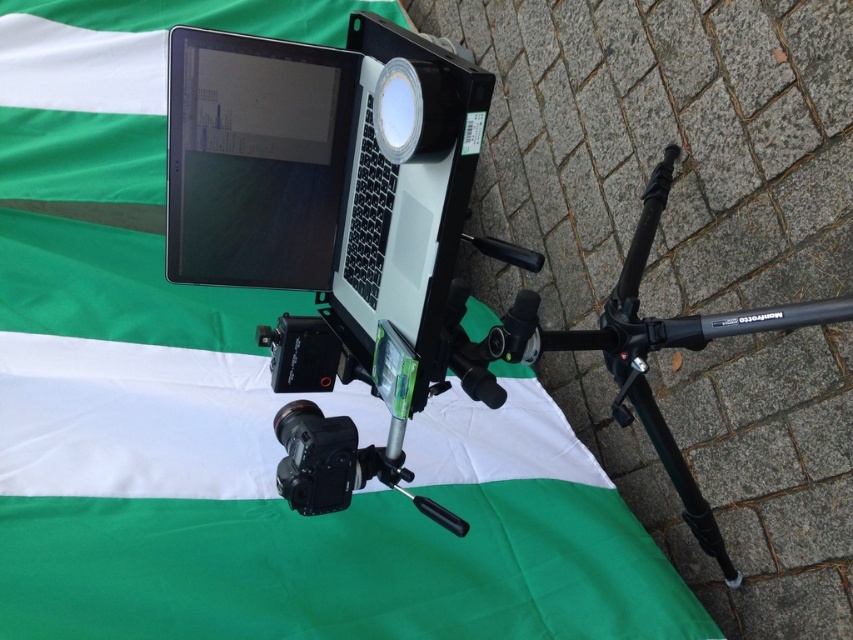
You are setting up equipment for a video call. You have a matte black laptop at upper center and a black matte tripod at center. Which object is wider?

The matte black laptop at upper center might be wider than the black matte tripod at center.

You are a photographer setting up equipment for a photoshoot. You have a matte black laptop at upper center and a black matte tripod at center. The distance between them is crucial for your setup. Can you confirm if the space between the two items is sufficient to allow a 1 meter long cable to reach from the laptop to the tripod?

The matte black laptop at upper center and the black matte tripod at center are 1.06 meters apart. Since the cable is 1 meter long, it may not be long enough to comfortably reach between them, as the distance is slightly greater than the cable length.

You are setting up equipment for a video call. You have a matte black laptop at upper center and a black matte tripod at center. Which equipment is closer to you?

The matte black laptop at upper center is closer to you because the black matte tripod at center is positioned behind it.